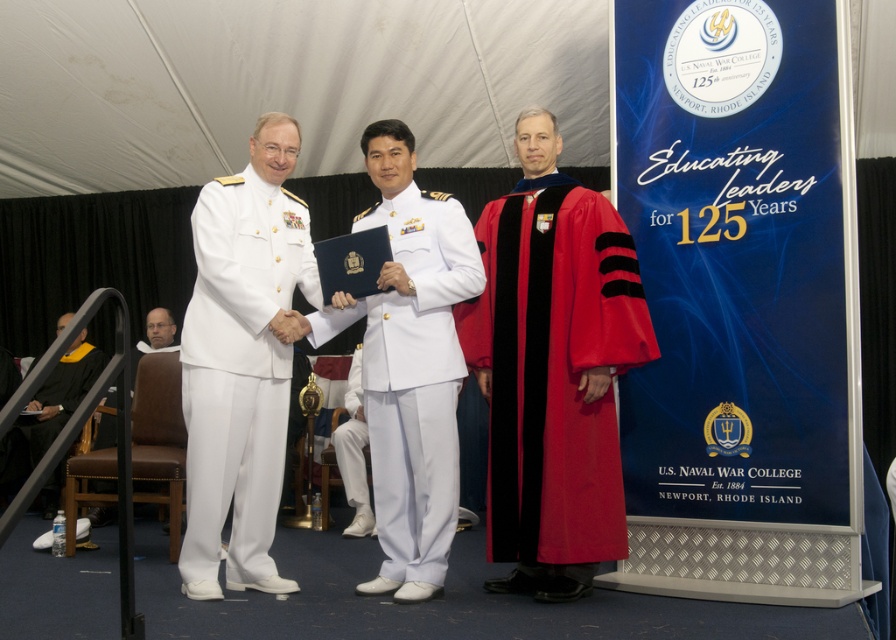
You are a photographer at the event and need to capture a clear photo of the white matte uniform at center and the white matte pants at center. Since both are white, will the uniform be easier to see compared to the pants in the photo?

The white matte uniform at center is in front of the white matte pants at center, so the uniform will be more visible in the photo as it is closer to the camera.

You are attending the U.S. Naval War College 125th anniversary event and notice two items in the foreground. Which item is positioned higher between the white matte uniform at center and the white matte pants at center?

The white matte uniform at center is positioned higher than the white matte pants at center.

You are attending the U.S. Naval War College 125th anniversary event and notice two graduation gowns. Which one is closer to you, the shiny red graduation gown at right or the black matte graduation gown at lower left?

The shiny red graduation gown at right is closer because it is in front of the black matte graduation gown at lower left.